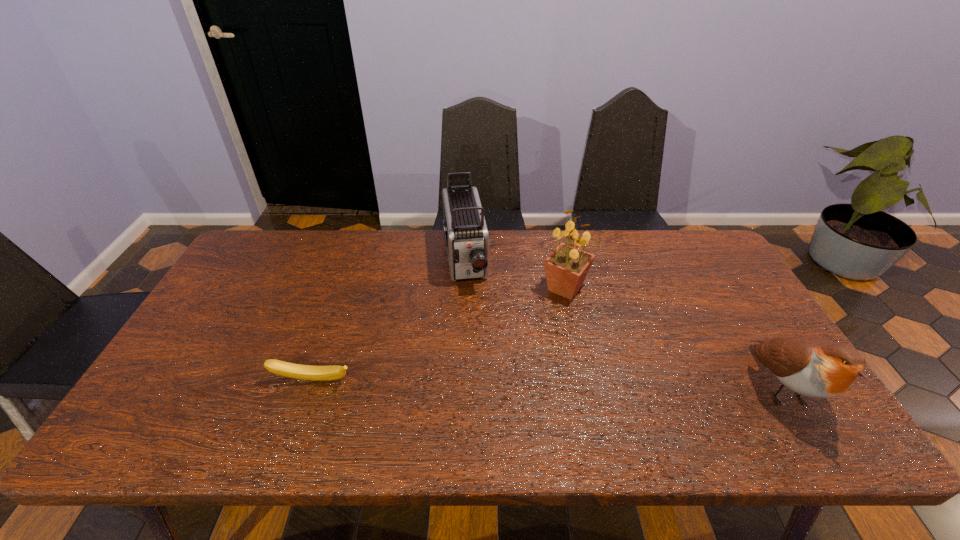
Where is `free space located at the lens of the second object from left to right`? This screenshot has height=540, width=960. free space located at the lens of the second object from left to right is located at coordinates (484, 401).

Identify the location of sunflower situated at the far edge. tap(566, 268).

Locate an element on the screen. The image size is (960, 540). camcorder present at the far edge is located at coordinates (466, 235).

Image resolution: width=960 pixels, height=540 pixels. I want to click on banana that is positioned at the near edge, so click(306, 372).

Where is `bird located in the near edge section of the desktop`? This screenshot has width=960, height=540. bird located in the near edge section of the desktop is located at coordinates (816, 367).

You are a GUI agent. You are given a task and a screenshot of the screen. Output one action in this format:
    pyautogui.click(x=<x>, y=<y>)
    Task: Click on the object located at the right edge
    The image size is (960, 540).
    Given the screenshot: What is the action you would take?
    pyautogui.click(x=816, y=367)

This screenshot has width=960, height=540. What are the coordinates of `object that is at the near right corner` in the screenshot? It's located at (816, 367).

You are a GUI agent. You are given a task and a screenshot of the screen. Output one action in this format:
    pyautogui.click(x=<x>, y=<y>)
    Task: Click on the vacant space at the far edge of the desktop
    The width and height of the screenshot is (960, 540).
    Given the screenshot: What is the action you would take?
    pyautogui.click(x=361, y=255)

Image resolution: width=960 pixels, height=540 pixels. I want to click on vacant space at the near edge of the desktop, so click(x=380, y=411).

Identify the location of vacant space at the left edge of the desktop. (242, 319).